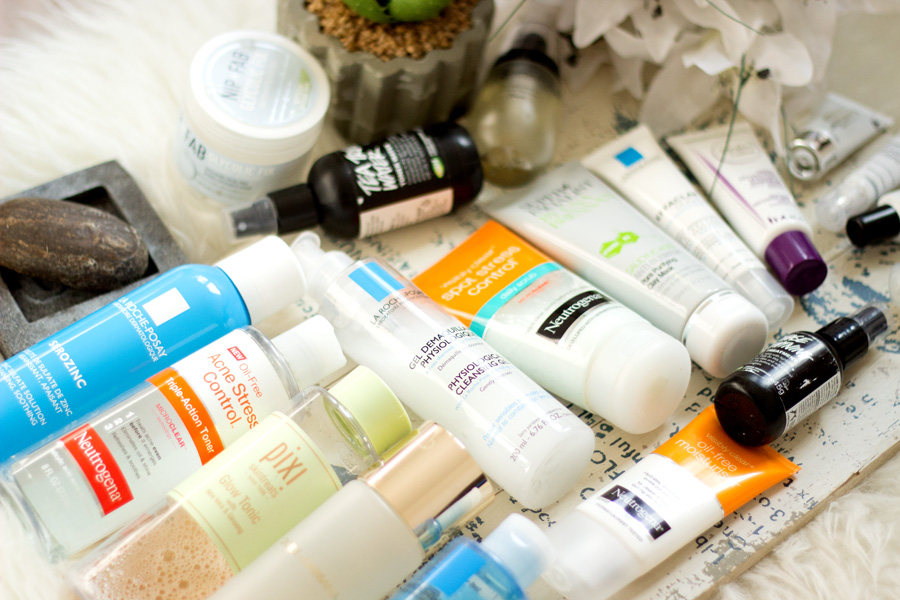
This screenshot has height=600, width=900. Identify the location of white cloth. (90, 83).